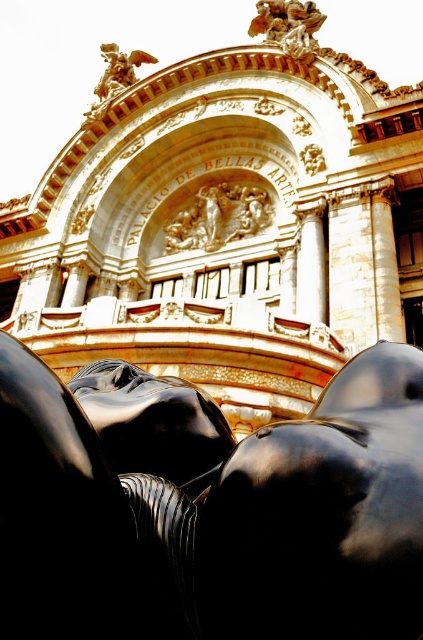
Question: Which object is farther from the camera taking this photo?

Choices:
 (A) black polished statue at lower center
 (B) black glossy statue at center

Answer: (B)

Question: Which object is the closest to the black polished statue at lower center?

Choices:
 (A) white marble column at center
 (B) black glossy statue at center
 (C) gold/gilded relief at center
 (D) gold ornate statue at upper center

Answer: (B)

Question: Can you confirm if black glossy statue at center is wider than white marble column at center?

Choices:
 (A) yes
 (B) no

Answer: (A)

Question: Does black polished statue at lower center appear on the right side of gold ornate statue at upper center?

Choices:
 (A) yes
 (B) no

Answer: (B)

Question: Which is farther from the black glossy statue at center?

Choices:
 (A) gold/gilded relief at center
 (B) black polished statue at lower center
 (C) gold ornate statue at upper center

Answer: (C)

Question: Can you confirm if black polished statue at lower center is bigger than black glossy statue at center?

Choices:
 (A) yes
 (B) no

Answer: (A)